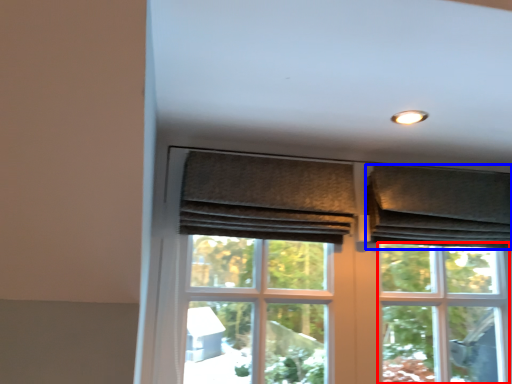
Question: Which point is further to the camera, bay window (highlighted by a red box) or curtain (highlighted by a blue box)?

Choices:
 (A) bay window
 (B) curtain

Answer: (B)